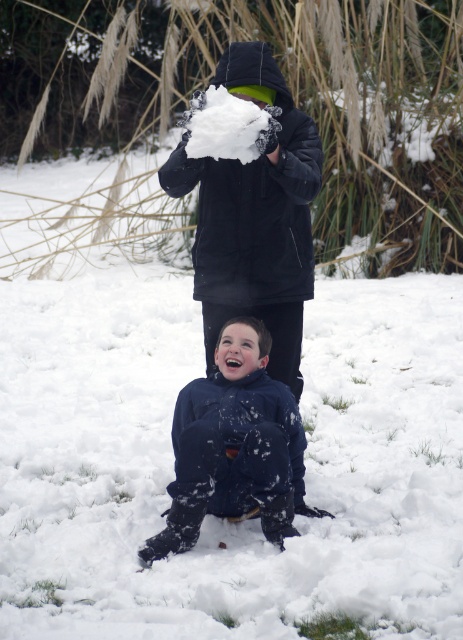
You are a photographer trying to capture a group photo of the matte black jacket at upper center and the dark blue snowsuit at center. The camera you are using has a minimum focusing distance of 20 inches. Can you take the photo without moving either of the subjects?

The distance between the matte black jacket at upper center and the dark blue snowsuit at center is 22.40 inches, which is greater than the camera minimum focusing distance of 20 inches. Therefore, you can take the photo without moving either of the subjects.

You are a photographer trying to capture both the matte black jacket at upper center and the dark blue snowsuit at center in a single frame. Based on their positions, which one would appear larger in the photo?

The matte black jacket at upper center appears larger in the photo because it is much taller than the dark blue snowsuit at center.